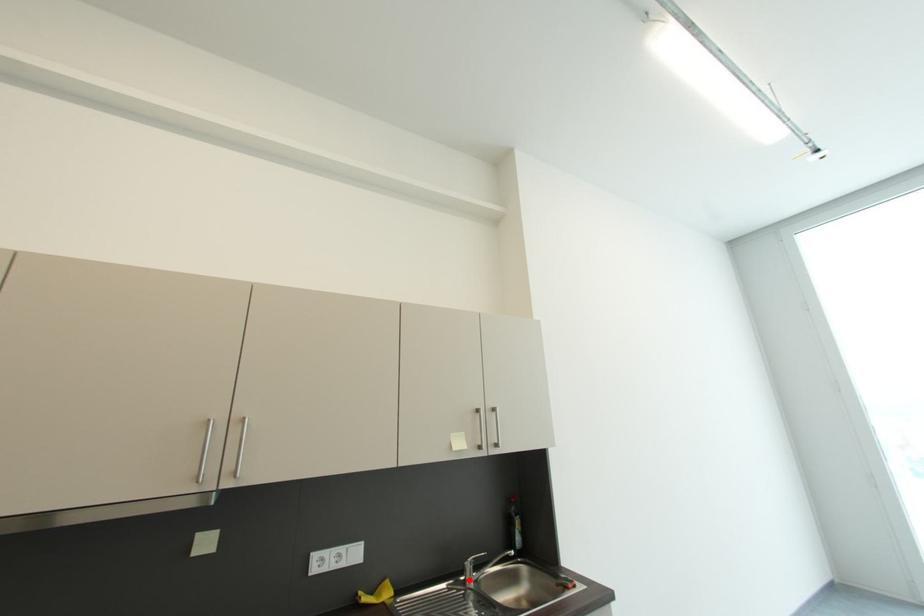
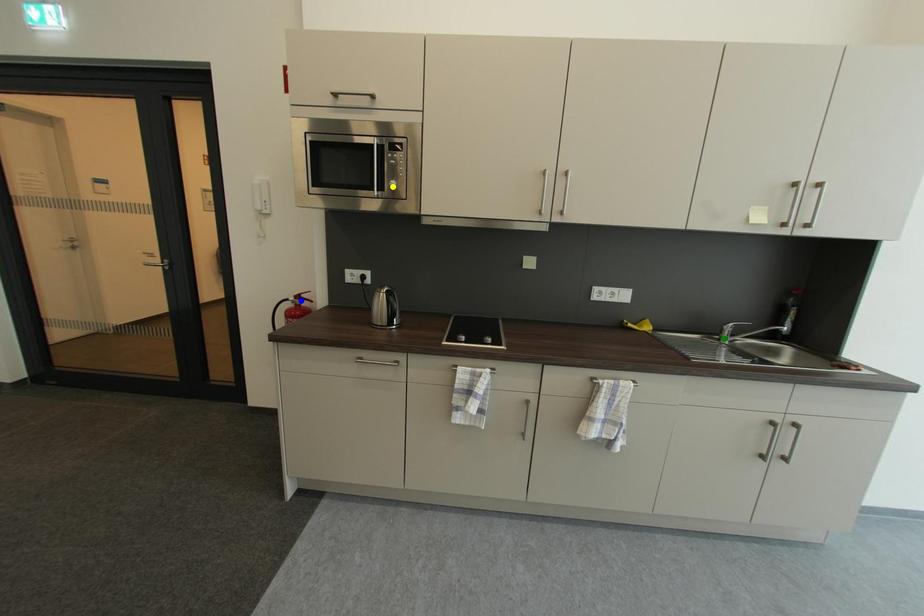
Question: I am providing you with two images of the same scene from different viewpoints. A red point is marked on the first image. You are given multiple points on the second image. In image 2, which mark is for the same physical point as the one in image 1?

Choices:
 (A) yellow point
 (B) green point
 (C) blue point

Answer: (B)